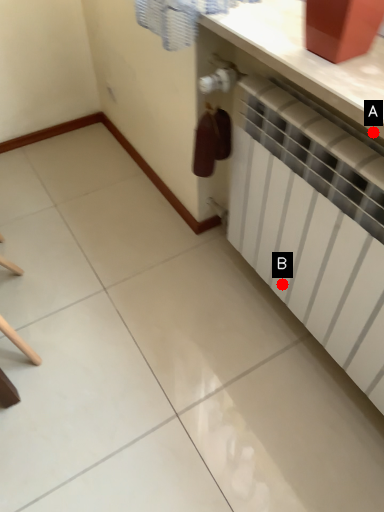
Question: Two points are circled on the image, labeled by A and B beside each circle. Which point is farther from the camera taking this photo?

Choices:
 (A) A is further
 (B) B is further

Answer: (B)